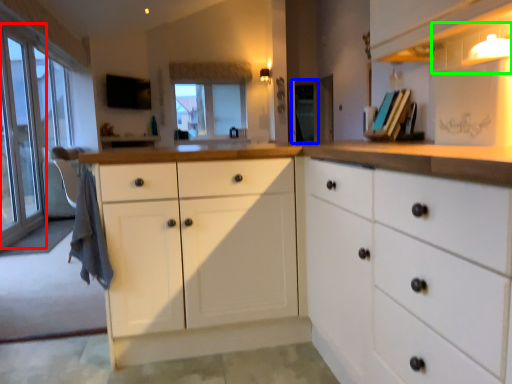
Question: Which object is positioned farthest from glass door (highlighted by a red box)? Select from screen door (highlighted by a blue box) and shelf (highlighted by a green box).

Choices:
 (A) screen door
 (B) shelf

Answer: (B)